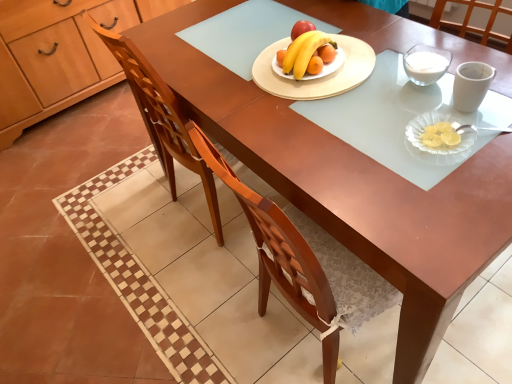
Question: In terms of size, does wooden chair at center appear bigger or smaller than wooden cabinet at left?

Choices:
 (A) big
 (B) small

Answer: (B)

Question: From a real-world perspective, is wooden chair at center physically located above or below wooden cabinet at left?

Choices:
 (A) above
 (B) below

Answer: (A)

Question: Which object is the farthest from the wooden round platter at center, the second platter ordered from the bottom?

Choices:
 (A) yellow matte banana at center
 (B) wooden cabinet at left
 (C) clear glass platter at lower right, placed as the 1th platter when sorted from right to left
 (D) wooden chair at center

Answer: (B)

Question: Considering the real-world distances, which object is closest to the wooden round platter at center, which ranks as the first platter in back-to-front order?

Choices:
 (A) wooden chair at center
 (B) clear glass platter at lower right, which appears as the second platter when viewed from the left
 (C) wooden cabinet at left
 (D) yellow matte banana at center

Answer: (D)